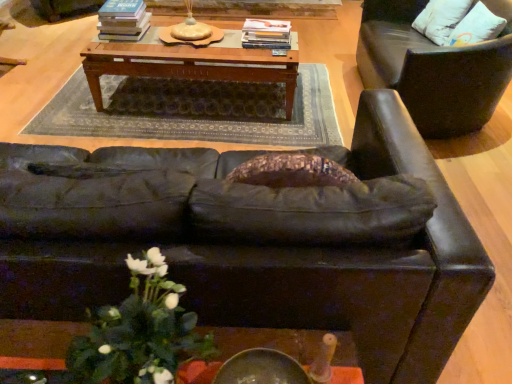
Question: Is point (99, 31) positioned closer to the camera than point (275, 26)?

Choices:
 (A) farther
 (B) closer

Answer: (B)

Question: Is hardcover books at center, the second book from the right, inside or outside of hardcover book at center, acting as the 1th book starting from the right?

Choices:
 (A) inside
 (B) outside

Answer: (B)

Question: Which is nearer to the hardcover book at center, acting as the 1th book starting from the right?

Choices:
 (A) wooden table at center
 (B) hardcover books at center, the 1th book from the left
 (C) white matte floral arrangement at lower left
 (D) matte black couch at center
 (E) white cotton pillow at upper right

Answer: (A)

Question: Which object is positioned farthest from the leather chair at right?

Choices:
 (A) hardcover book at center, which appears as the 2th book when viewed from the left
 (B) matte black couch at center
 (C) hardcover books at center, the second book from the right
 (D) white matte floral arrangement at lower left
 (E) white cotton pillow at upper right

Answer: (D)